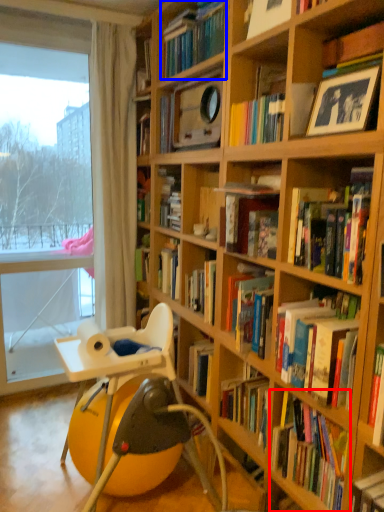
Question: Which object appears farthest to the camera in this image, book (highlighted by a red box) or book (highlighted by a blue box)?

Choices:
 (A) book
 (B) book

Answer: (B)